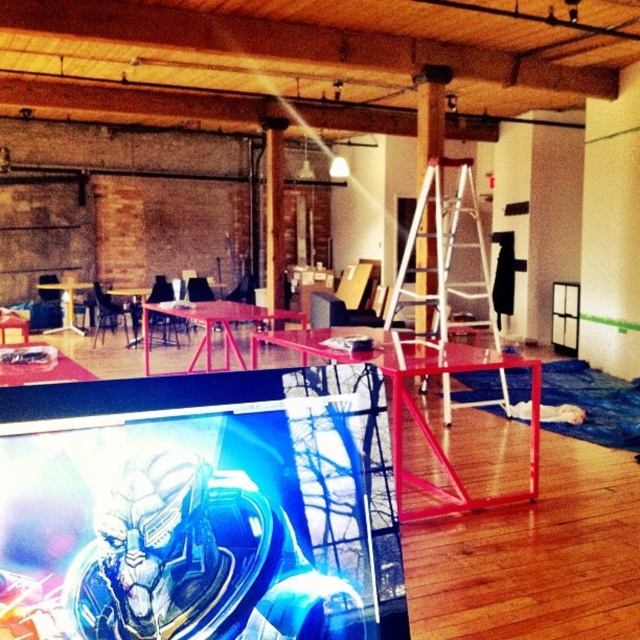
Question: Considering the relative positions of white metal ladder at center and white glossy pillar at center in the image provided, where is white metal ladder at center located with respect to white glossy pillar at center?

Choices:
 (A) below
 (B) above

Answer: (A)

Question: Is white metal ladder at center smaller than white glossy pillar at center?

Choices:
 (A) yes
 (B) no

Answer: (B)

Question: Which of the following is the farthest from the observer?

Choices:
 (A) (474, 296)
 (B) (276, 321)

Answer: (B)

Question: Can you confirm if white metal ladder at center is positioned to the right of white glossy pillar at center?

Choices:
 (A) yes
 (B) no

Answer: (A)

Question: Which object appears farthest from the camera in this image?

Choices:
 (A) white glossy pillar at center
 (B) white metal ladder at center

Answer: (A)